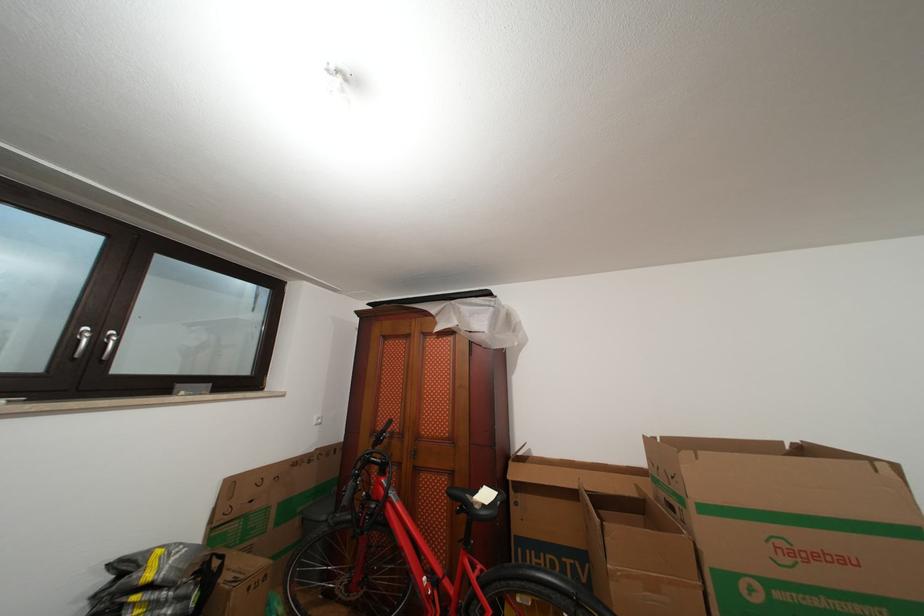
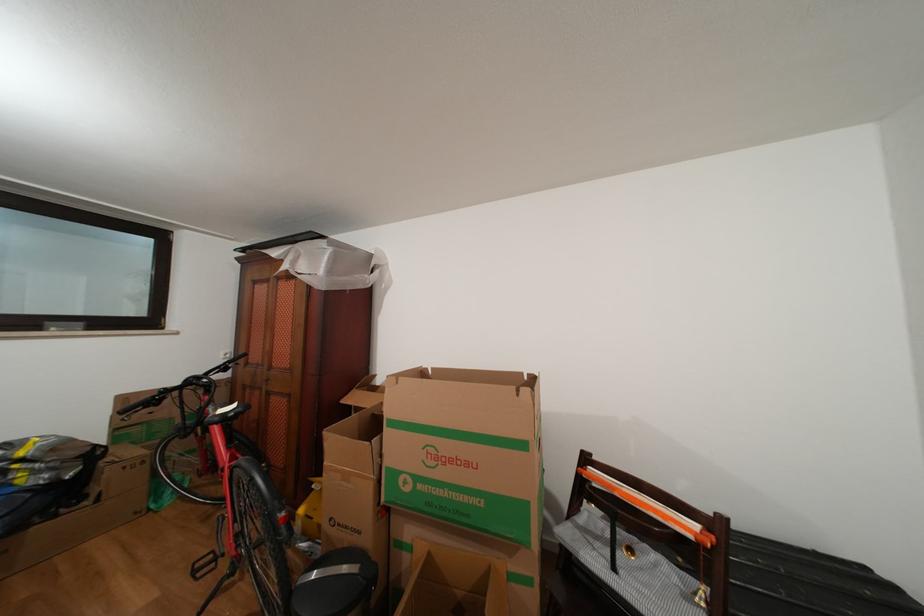
Find the pixel in the second image that matches point 187,391 in the first image.

(56, 329)